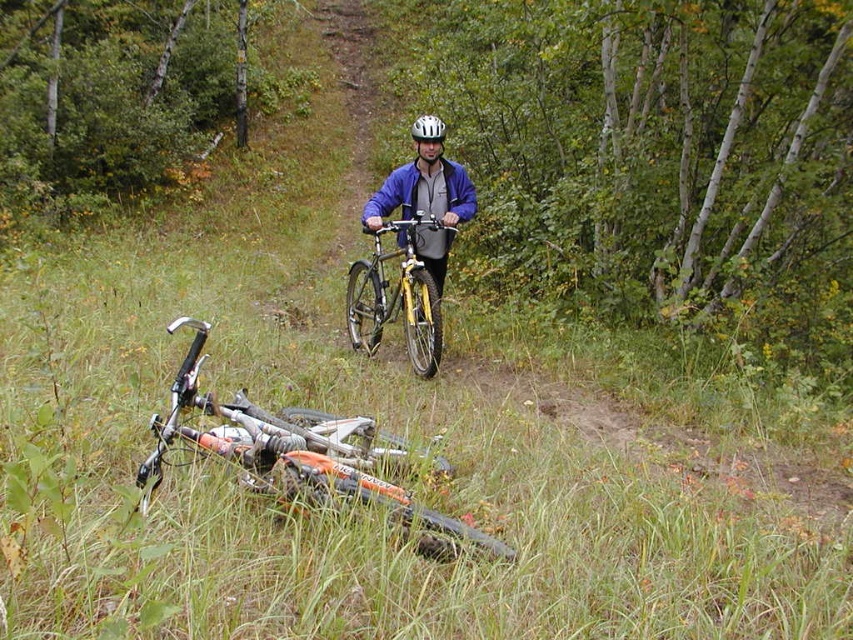
You are a hiker who has just arrived at the forest path. You see a yellow metallic bicycle at center and a white matte bicycle helmet at center. Which object is smaller in size?

The yellow metallic bicycle at center is smaller in size compared to the white matte bicycle helmet at center.

You are a hiker who has lost your way in the forest. You see an orange matte mountain bike at lower left. Can you estimate the coordinates of the bike to help locate it?

The orange matte mountain bike at lower left is located at coordinates point (299,454).

You are a hiker who has just arrived at the forest path. You see an orange matte mountain bike at lower left and a white matte bicycle helmet at center. Which object is closer to the ground?

The orange matte mountain bike at lower left is closer to the ground because it is below the white matte bicycle helmet at center.